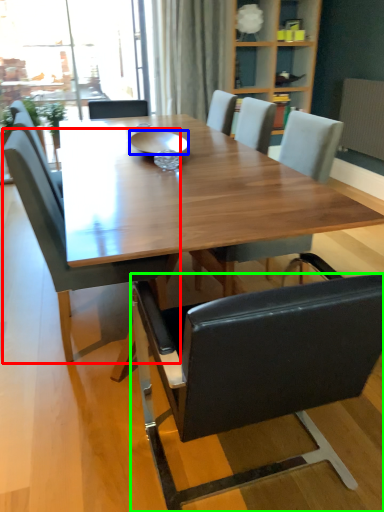
Question: Which object is positioned farthest from chair (highlighted by a red box)? Select from bowl (highlighted by a blue box) and chair (highlighted by a green box).

Choices:
 (A) bowl
 (B) chair

Answer: (A)